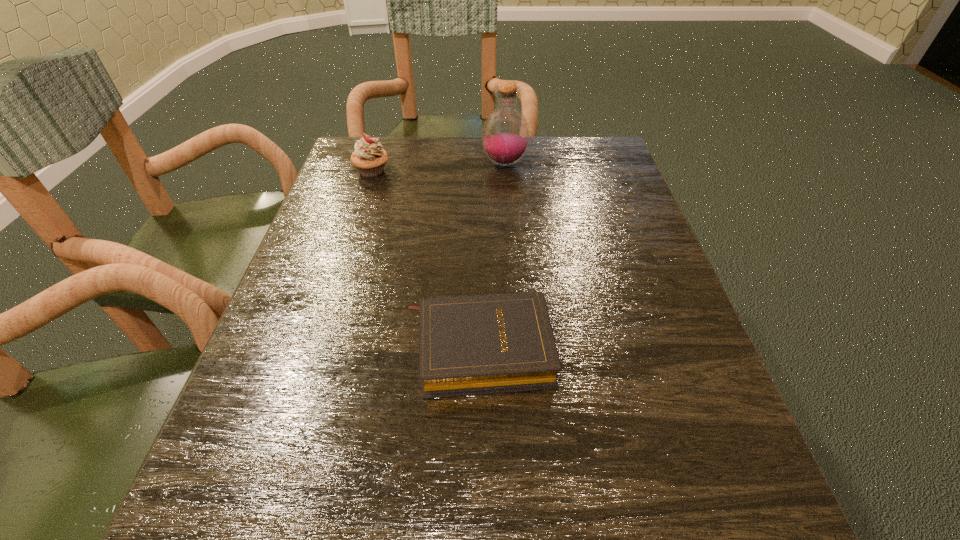
Where is `vacant space that satisfies the following two spatial constraints: 1. on the front side of the shortest object; 2. on the left side of the second shortest object`? The image size is (960, 540). vacant space that satisfies the following two spatial constraints: 1. on the front side of the shortest object; 2. on the left side of the second shortest object is located at coordinates (316, 348).

Image resolution: width=960 pixels, height=540 pixels. Identify the location of free location that satisfies the following two spatial constraints: 1. on the back side of the leftmost object; 2. on the right side of the bottle. (374, 164).

Find the location of `free location that satisfies the following two spatial constraints: 1. on the front side of the second tallest object; 2. on the right side of the Bible`. free location that satisfies the following two spatial constraints: 1. on the front side of the second tallest object; 2. on the right side of the Bible is located at coordinates (316, 348).